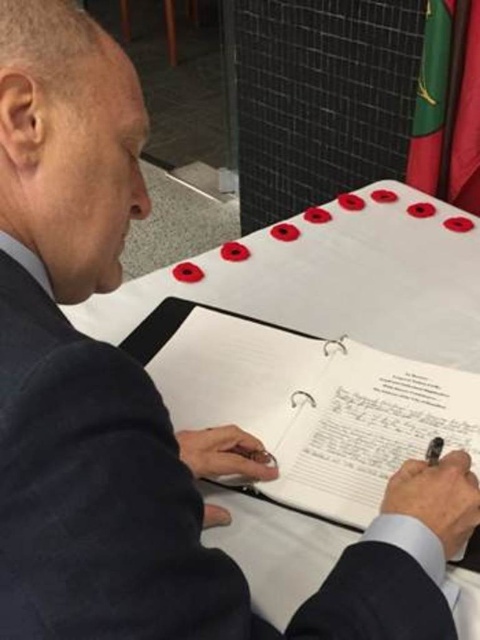
Is white paper at center shorter than green fabric flag at upper right?

Indeed, white paper at center has a lesser height compared to green fabric flag at upper right.

This screenshot has height=640, width=480. I want to click on white paper at center, so click(x=305, y=403).

Who is more distant from viewer, (468, 563) or (420, 116)?

Positioned behind is point (420, 116).

Find the location of a particular element. This screenshot has width=480, height=640. white paper at center is located at coordinates (305, 403).